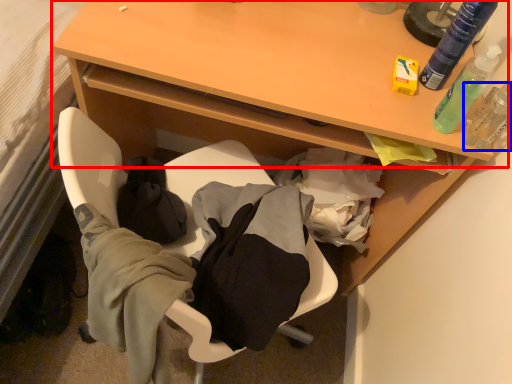
Question: Which point is closer to the camera, table (highlighted by a red box) or toiletry (highlighted by a blue box)?

Choices:
 (A) table
 (B) toiletry

Answer: (B)